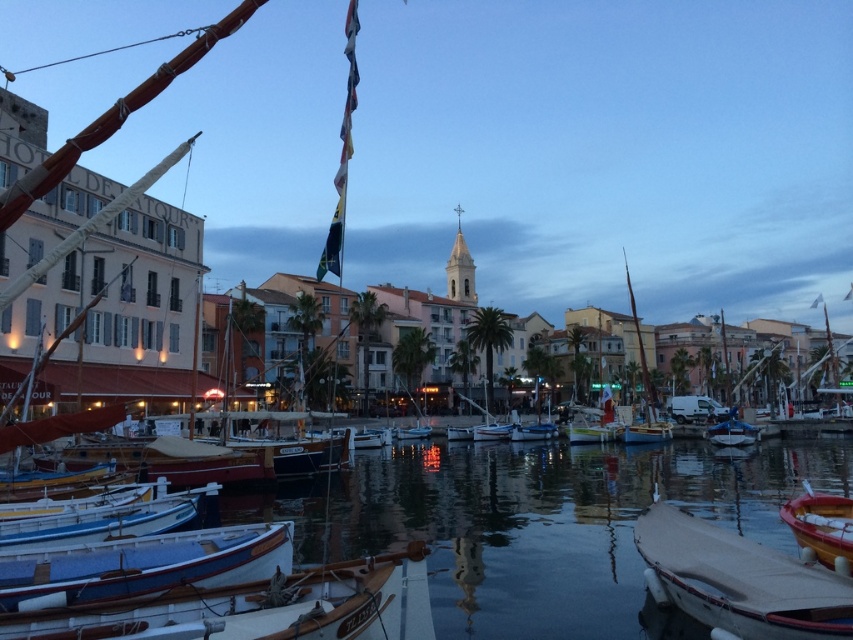
Between point (756, 586) and point (115, 595), which one is positioned behind?

The point (756, 586) is behind.

Does point (820, 593) come farther from viewer compared to point (219, 582)?

No, it is in front of (219, 582).

The image size is (853, 640). I want to click on wooden boat at lower right, so click(738, 580).

Is white wooden boat at lower left wider than blue wooden boat at lower left?

Yes.

Measure the distance between white wooden boat at lower left and camera.

31.41 meters

Does point (193, 608) come closer to viewer compared to point (51, 576)?

Yes, it is.

The width and height of the screenshot is (853, 640). I want to click on white wooden boat at lower left, so click(257, 608).

Consider the image. Does smooth water at center lie in front of wooden boat at lower right?

No, smooth water at center is behind wooden boat at lower right.

Is smooth water at center below wooden boat at lower right?

Yes, smooth water at center is below wooden boat at lower right.

Who is more forward, (585,502) or (753,627)?

Point (753,627) is in front.

At what (x,y) coordinates should I click in order to perform the action: click on smooth water at center. Please return your answer as a coordinate pair (x, y). The image size is (853, 640). Looking at the image, I should click on (560, 524).